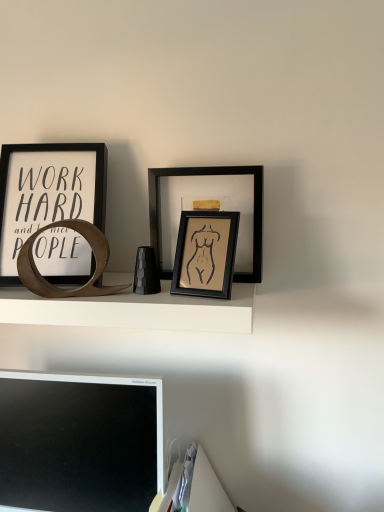
Question: From the image's perspective, is matte black picture frame at center, acting as the first picture frame starting from the right, above black matte computer monitor at lower left?

Choices:
 (A) yes
 (B) no

Answer: (A)

Question: Is matte black picture frame at center, acting as the first picture frame starting from the right, directly adjacent to black matte computer monitor at lower left?

Choices:
 (A) yes
 (B) no

Answer: (B)

Question: Is matte black picture frame at center, which ranks as the 3th picture frame in left-to-right order, to the right of black matte computer monitor at lower left from the viewer's perspective?

Choices:
 (A) yes
 (B) no

Answer: (A)

Question: Is matte black picture frame at center, acting as the first picture frame starting from the right, far away from black matte computer monitor at lower left?

Choices:
 (A) no
 (B) yes

Answer: (A)

Question: Is the position of matte black picture frame at center, acting as the first picture frame starting from the right, more distant than that of black matte computer monitor at lower left?

Choices:
 (A) no
 (B) yes

Answer: (B)

Question: Considering the positions of black matte computer monitor at lower left and matte black picture frame at center, acting as the first picture frame starting from the right, in the image, is black matte computer monitor at lower left taller or shorter than matte black picture frame at center, acting as the first picture frame starting from the right,?

Choices:
 (A) tall
 (B) short

Answer: (A)

Question: Is black matte computer monitor at lower left in front of or behind matte black picture frame at center, which ranks as the 3th picture frame in left-to-right order, in the image?

Choices:
 (A) front
 (B) behind

Answer: (A)

Question: Based on their sizes in the image, would you say black matte computer monitor at lower left is bigger or smaller than matte black picture frame at center, acting as the first picture frame starting from the right?

Choices:
 (A) big
 (B) small

Answer: (A)

Question: From a real-world perspective, relative to matte black picture frame at center, which ranks as the 3th picture frame in left-to-right order, is black matte computer monitor at lower left vertically above or below?

Choices:
 (A) above
 (B) below

Answer: (B)

Question: Considering the positions of matte black picture frame at left, the 3th picture frame in the right-to-left sequence, and white matte shelf at center in the image, is matte black picture frame at left, the 3th picture frame in the right-to-left sequence, bigger or smaller than white matte shelf at center?

Choices:
 (A) big
 (B) small

Answer: (B)

Question: From the image's perspective, is matte black picture frame at left, acting as the first picture frame starting from the left, above or below white matte shelf at center?

Choices:
 (A) above
 (B) below

Answer: (A)

Question: Looking at their shapes, would you say matte black picture frame at left, the 3th picture frame in the right-to-left sequence, is wider or thinner than white matte shelf at center?

Choices:
 (A) wide
 (B) thin

Answer: (B)

Question: In the image, is matte black picture frame at left, the 3th picture frame in the right-to-left sequence, positioned in front of or behind white matte shelf at center?

Choices:
 (A) behind
 (B) front

Answer: (A)

Question: From a real-world perspective, relative to matte black picture frame at left, acting as the first picture frame starting from the left, is white matte shelf at center vertically above or below?

Choices:
 (A) below
 (B) above

Answer: (A)

Question: Would you say white matte shelf at center is inside or outside matte black picture frame at left, the 3th picture frame in the right-to-left sequence?

Choices:
 (A) inside
 (B) outside

Answer: (B)